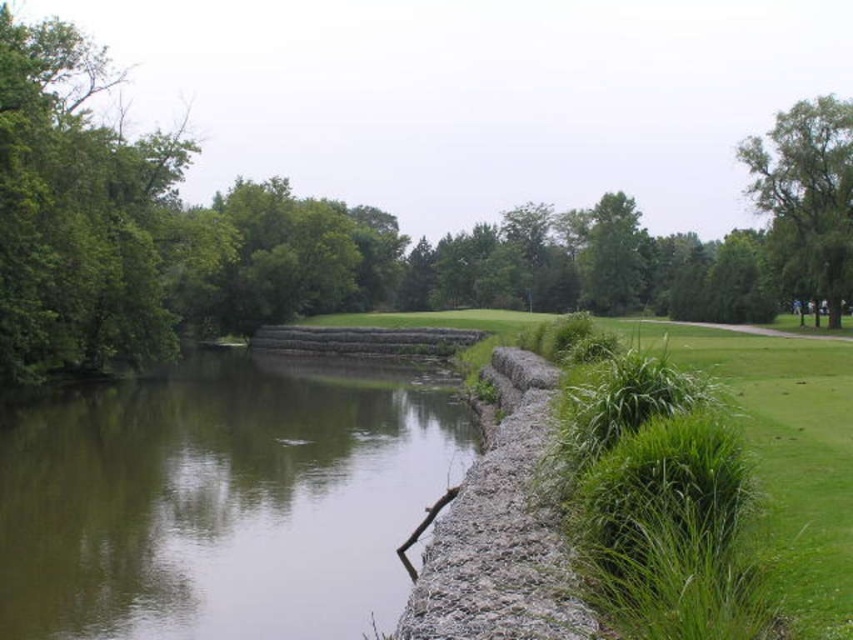
In the scene shown: Is green concrete river at lower left smaller than green leafy tree at upper right?

Yes.

Does green concrete river at lower left have a greater height compared to green leafy tree at upper right?

No.

The height and width of the screenshot is (640, 853). Identify the location of green concrete river at lower left. (219, 500).

Who is more distant from viewer, (776, 252) or (802, 236)?

The point (776, 252) is behind.

Is green leafy tree at upper left positioned in front of green leafy tree at upper right?

Yes, it is in front of green leafy tree at upper right.

Which is behind, point (90, 192) or point (817, 196)?

The point (817, 196) is behind.

Where is `green leafy tree at upper left`? green leafy tree at upper left is located at coordinates (206, 234).

Who is shorter, green concrete river at lower left or green leafy tree at upper center?

Standing shorter between the two is green concrete river at lower left.

Is green concrete river at lower left taller than green leafy tree at upper center?

No.

Identify the location of green concrete river at lower left. (219, 500).